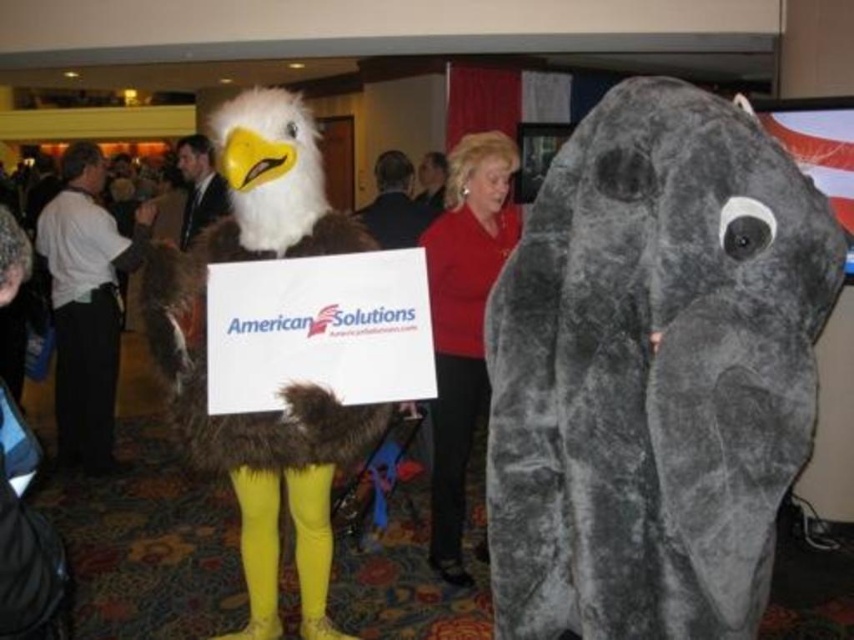
Looking at this image, you are standing at a distance of 5 feet from the point marked at coordinates point (512, 403). Can you confirm if you are currently at that exact point?

The point (512, 403) is 5.10 feet away from the viewer, so if you are standing at 5 feet away, you are very close to the point but not exactly at it.

You are a photographer at the event and need to capture a photo of both the white fur eagle at left and the smooth suit at center. The camera you have can only focus on objects within a 30 inch range. Can you take a photo that includes both subjects without moving either?

The white fur eagle at left and smooth suit at center are 28.60 inches apart, so yes, the camera can focus on both subjects since the distance between them is within the 30 inch range.